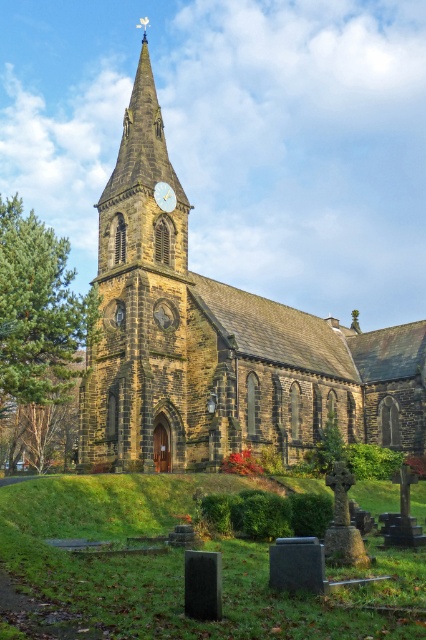
Can you confirm if green leafy tree at left is shorter than gold metallic clock at center?

In fact, green leafy tree at left may be taller than gold metallic clock at center.

Which of these two, green leafy tree at left or gold metallic clock at center, stands taller?

With more height is green leafy tree at left.

I want to click on green leafy tree at left, so click(39, 308).

Does brown stone clock tower at center appear under gold metallic clock at center?

Incorrect, brown stone clock tower at center is not positioned below gold metallic clock at center.

Is point (154, 301) closer to viewer compared to point (172, 195)?

Yes, it is.

Between point (101, 307) and point (164, 193), which one is positioned in front?

Point (101, 307)

Where is `brown stone clock tower at center`? brown stone clock tower at center is located at coordinates (138, 305).

Is brown stone church at center to the left of green leafy tree at left from the viewer's perspective?

Incorrect, brown stone church at center is not on the left side of green leafy tree at left.

Is point (298, 346) closer to camera compared to point (36, 289)?

No, it is behind (36, 289).

Between point (104, 296) and point (29, 378), which one is positioned behind?

Positioned behind is point (104, 296).

Identify the location of brown stone church at center. This screenshot has height=640, width=426. (218, 342).